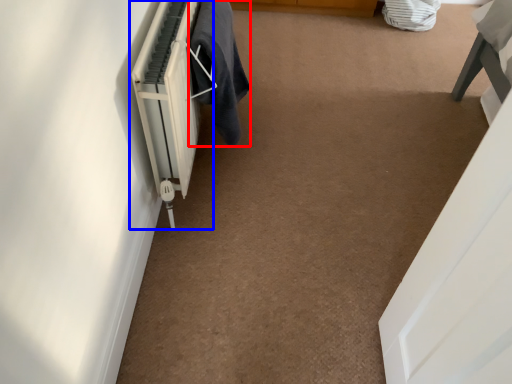
Question: Which object is closer to the camera taking this photo, laundry (highlighted by a red box) or radiator (highlighted by a blue box)?

Choices:
 (A) laundry
 (B) radiator

Answer: (B)